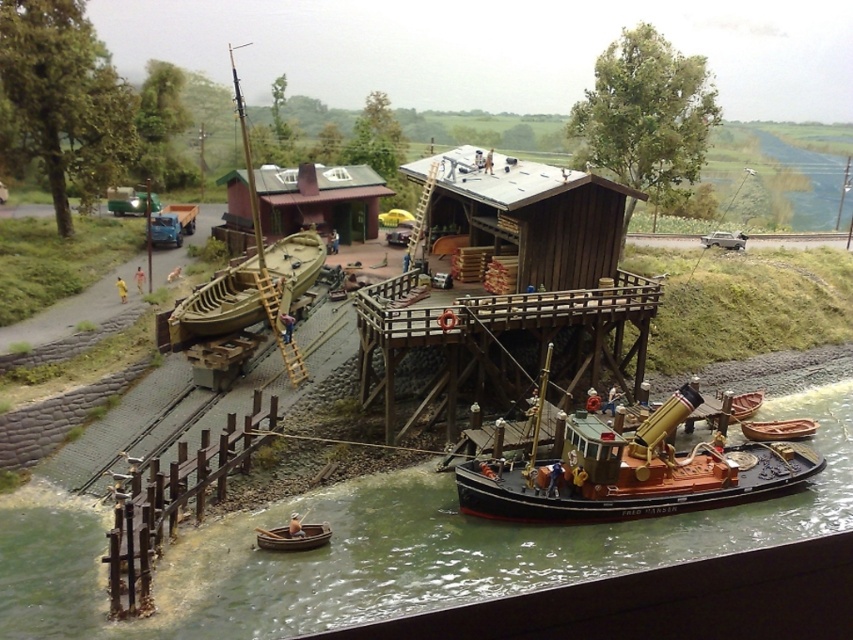
You are standing on the wooden boat at lower center and want to reach the greenish water at lower center. Which direction should you move to get there?

You should move to the right because the greenish water at lower center is to the right of the wooden boat at lower center.

You are a photographer standing at the camera position. You want to take a photo of both point (x=525, y=522) and point (x=296, y=264). Which point will appear larger in the photo?

Point (x=525, y=522) is closer to the camera than point (x=296, y=264), so it will appear larger in the photo.

Please look at the point marked at coordinates (381, 548). According to the scene description, where exactly is this point located?

The point at coordinates (381, 548) is on the greenish water at lower center.